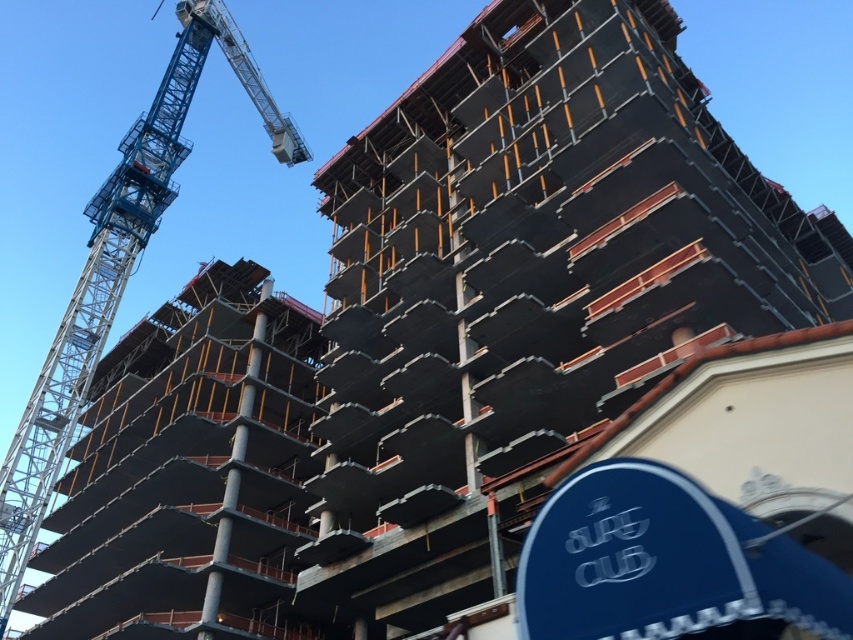
Is concrete scaffolding at center taller than blue metallic crane at upper left?

No, concrete scaffolding at center is not taller than blue metallic crane at upper left.

Which is below, concrete scaffolding at center or blue metallic crane at upper left?

Positioned lower is concrete scaffolding at center.

Between point (560, 396) and point (12, 465), which one is positioned in front?

Positioned in front is point (560, 396).

The height and width of the screenshot is (640, 853). Find the location of `concrete scaffolding at center`. concrete scaffolding at center is located at coordinates (526, 291).